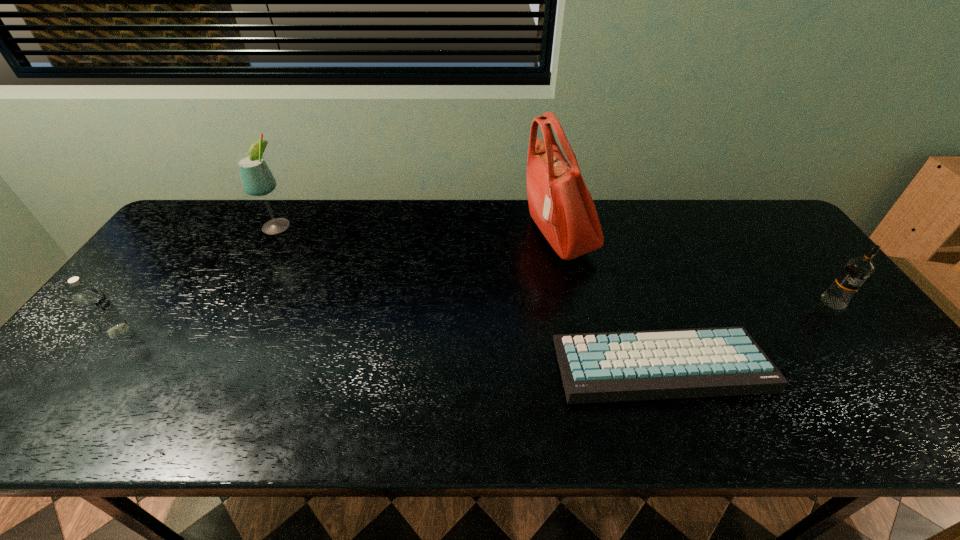
You are a GUI agent. You are given a task and a screenshot of the screen. Output one action in this format:
    pyautogui.click(x=<x>, y=<y>)
    Task: Click on the tallest object
    The height and width of the screenshot is (540, 960).
    Given the screenshot: What is the action you would take?
    pyautogui.click(x=560, y=204)

The width and height of the screenshot is (960, 540). I want to click on the fourth object from right to left, so click(257, 179).

You are a GUI agent. You are given a task and a screenshot of the screen. Output one action in this format:
    pyautogui.click(x=<x>, y=<y>)
    Task: Click on the fourth shortest object
    The height and width of the screenshot is (540, 960).
    Given the screenshot: What is the action you would take?
    pyautogui.click(x=257, y=179)

The image size is (960, 540). In order to click on the rightmost object in this screenshot , I will do `click(857, 270)`.

Locate an element on the screen. Image resolution: width=960 pixels, height=540 pixels. the third nearest object is located at coordinates (857, 270).

The height and width of the screenshot is (540, 960). I want to click on the leftmost object, so click(94, 304).

Where is `the left vodka`? the left vodka is located at coordinates (94, 304).

What are the coordinates of `the shortest object` in the screenshot? It's located at (726, 361).

Identify the location of vacant area situated on the front-facing side of the handbag. (464, 235).

You are a GUI agent. You are given a task and a screenshot of the screen. Output one action in this format:
    pyautogui.click(x=<x>, y=<y>)
    Task: Click on the free space located on the front-facing side of the handbag
    The image size is (960, 540).
    Given the screenshot: What is the action you would take?
    pyautogui.click(x=432, y=235)